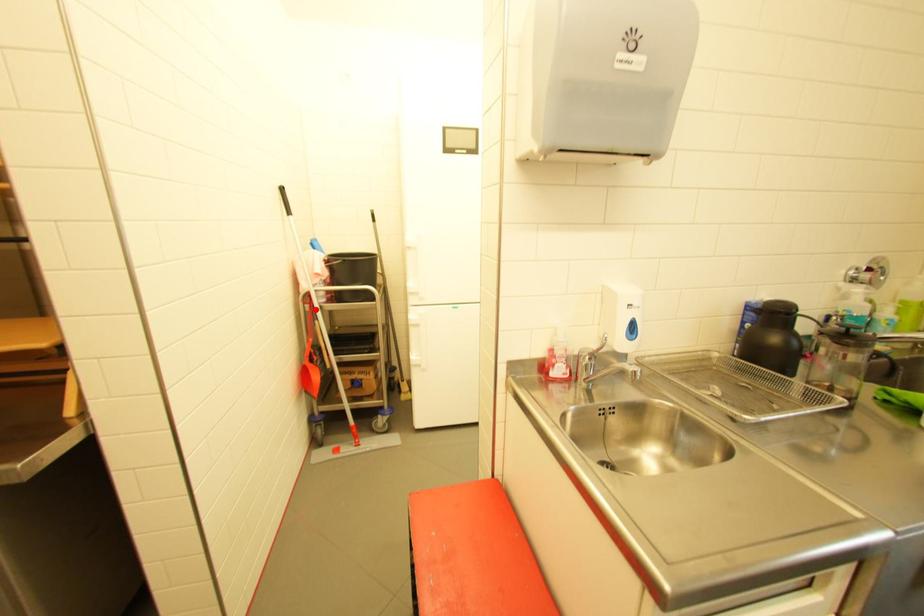
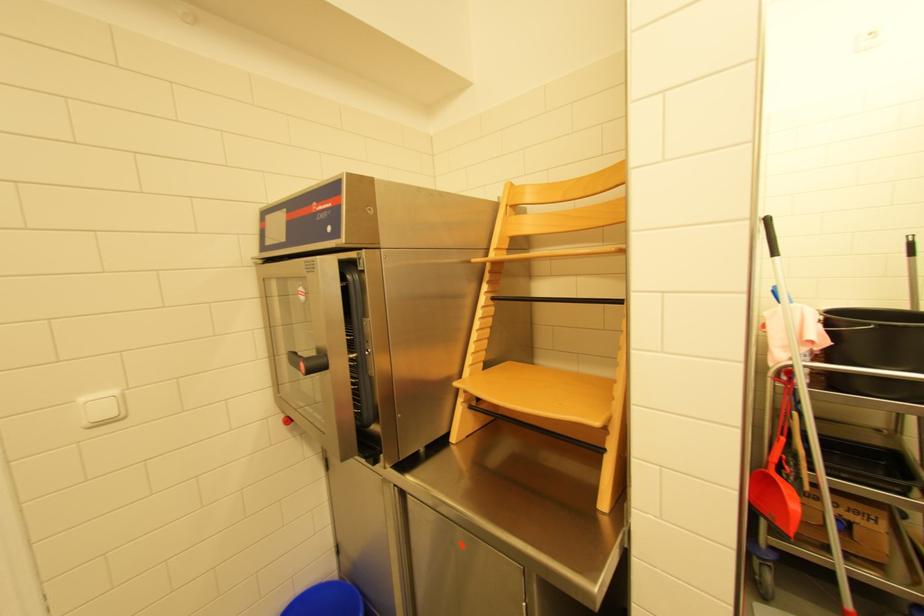
Question: I am providing you with two images of the same scene from different viewpoints. Given a red point in image1, look at the same physical point in image2. Is it:

Choices:
 (A) Closer to the viewpoint
 (B) Farther from the viewpoint

Answer: (B)